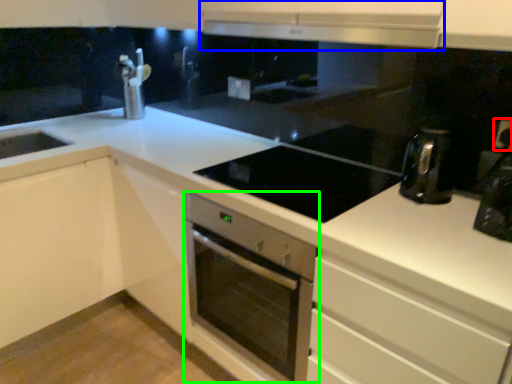
Question: Which object is positioned farthest from electric outlet (highlighted by a red box)? Select from exhaust hood (highlighted by a blue box) and home appliance (highlighted by a green box).

Choices:
 (A) exhaust hood
 (B) home appliance

Answer: (B)